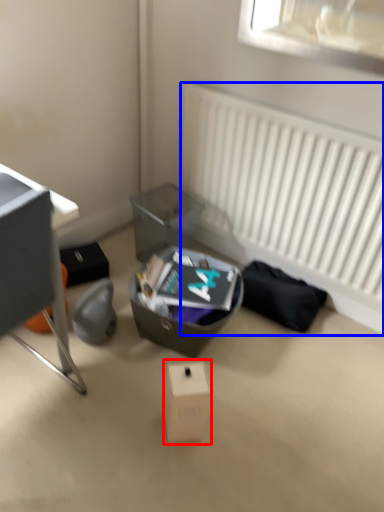
Question: Among these objects, which one is farthest to the camera, cardboard box (highlighted by a red box) or radiator (highlighted by a blue box)?

Choices:
 (A) cardboard box
 (B) radiator

Answer: (B)